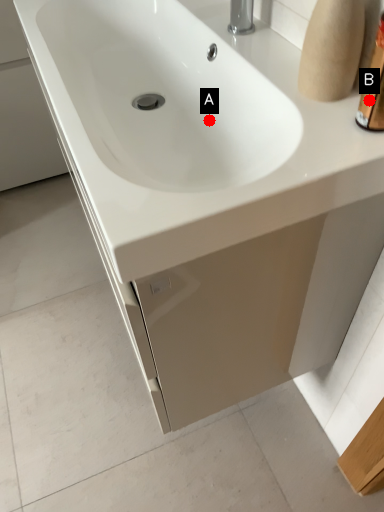
Question: Two points are circled on the image, labeled by A and B beside each circle. Which point is further to the camera?

Choices:
 (A) A is further
 (B) B is further

Answer: (A)